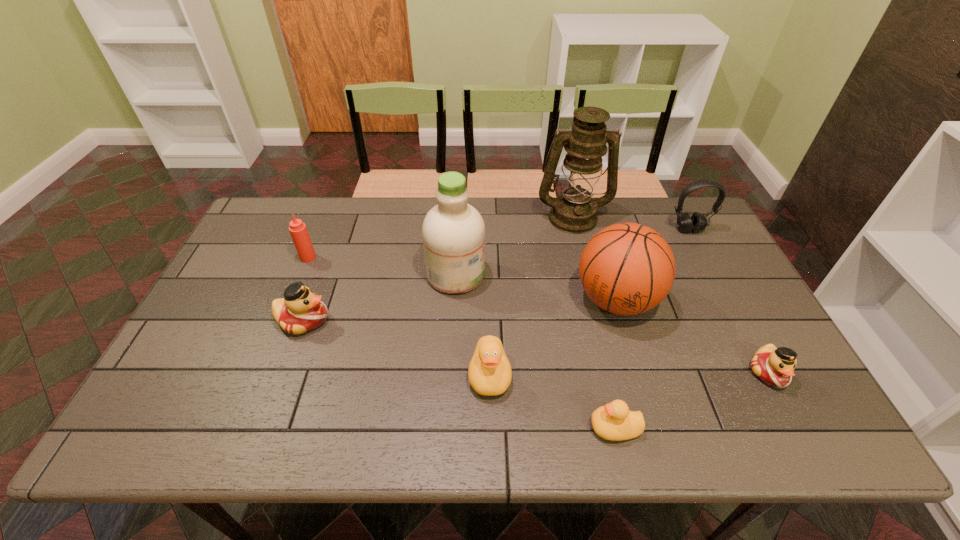
Identify the location of the rightmost duck. This screenshot has height=540, width=960. (774, 366).

The width and height of the screenshot is (960, 540). I want to click on the nearer red duck, so click(x=774, y=366).

At what (x,y) coordinates should I click in order to perform the action: click on the smaller yellow duck. Please return your answer as a coordinate pair (x, y). This screenshot has height=540, width=960. Looking at the image, I should click on (614, 421).

The height and width of the screenshot is (540, 960). I want to click on the third duck from left to right, so click(614, 421).

Where is `free spot located on the left of the oil lamp`? The image size is (960, 540). free spot located on the left of the oil lamp is located at coordinates (471, 217).

This screenshot has height=540, width=960. I want to click on vacant area situated on the front label of the cleansing agent, so point(529,274).

Where is `vacant space located on the left of the basketball`? The height and width of the screenshot is (540, 960). vacant space located on the left of the basketball is located at coordinates (541, 300).

This screenshot has height=540, width=960. What are the coordinates of `free space located on the front-facing side of the headset` in the screenshot? It's located at (718, 286).

You are a GUI agent. You are given a task and a screenshot of the screen. Output one action in this format:
    pyautogui.click(x=<x>, y=<y>)
    Task: Click on the vacant area situated on the right of the Tabasco sauce
    This screenshot has height=540, width=960.
    Given the screenshot: What is the action you would take?
    pyautogui.click(x=444, y=257)

The image size is (960, 540). Identify the location of free space located 0.330m on the face of the left red duck. (452, 320).